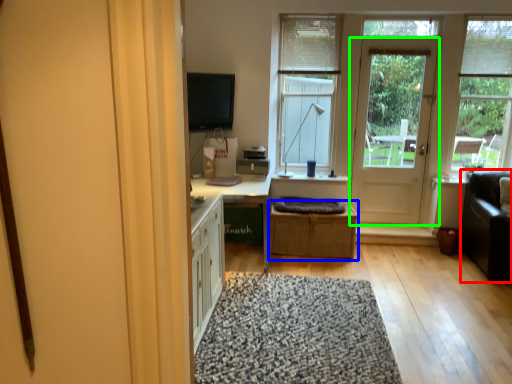
Question: Which object is the closest to the couch (highlighted by a red box)? Choose among these: crate (highlighted by a blue box) or door (highlighted by a green box).

Choices:
 (A) crate
 (B) door

Answer: (B)